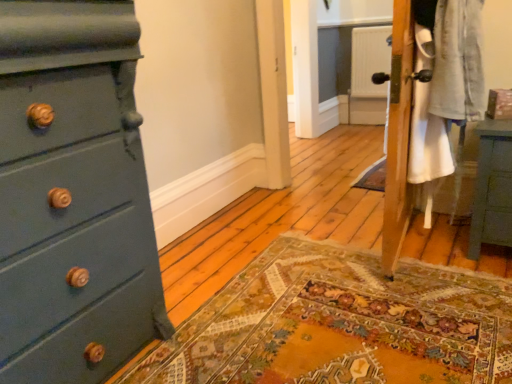
You are a GUI agent. You are given a task and a screenshot of the screen. Output one action in this format:
    pyautogui.click(x=<x>, y=<y>)
    Task: Click on the matte teal dresser at left
    The width and height of the screenshot is (512, 384).
    Given the screenshot: What is the action you would take?
    pyautogui.click(x=73, y=195)

What do you see at coordinates (73, 195) in the screenshot? This screenshot has height=384, width=512. I see `matte teal dresser at left` at bounding box center [73, 195].

This screenshot has height=384, width=512. What do you see at coordinates (492, 188) in the screenshot? I see `teal painted wood nightstand at right` at bounding box center [492, 188].

The height and width of the screenshot is (384, 512). I want to click on teal painted wood nightstand at right, so click(x=492, y=188).

Locate an element on the screen. Image resolution: width=512 pixels, height=384 pixels. matte teal dresser at left is located at coordinates (73, 195).

Considering the positions of objects matte teal dresser at left and teal painted wood nightstand at right in the image provided, who is more to the right, matte teal dresser at left or teal painted wood nightstand at right?

Positioned to the right is teal painted wood nightstand at right.

Is matte teal dresser at left in front of or behind teal painted wood nightstand at right in the image?

Clearly, matte teal dresser at left is in front of teal painted wood nightstand at right.

Consider the image. Which point is more forward, (113,224) or (510,186)?

The point (113,224) is more forward.

From the image's perspective, which object appears higher, matte teal dresser at left or teal painted wood nightstand at right?

From the image's view, teal painted wood nightstand at right is above.

From a real-world perspective, is matte teal dresser at left physically located above or below teal painted wood nightstand at right?

Clearly, from a real-world perspective, matte teal dresser at left is above teal painted wood nightstand at right.

Can you confirm if matte teal dresser at left is wider than teal painted wood nightstand at right?

Correct, the width of matte teal dresser at left exceeds that of teal painted wood nightstand at right.

From their relative heights in the image, would you say matte teal dresser at left is taller or shorter than teal painted wood nightstand at right?

Considering their sizes, matte teal dresser at left has more height than teal painted wood nightstand at right.

Can you confirm if matte teal dresser at left is smaller than teal painted wood nightstand at right?

No.

Which is correct: matte teal dresser at left is inside teal painted wood nightstand at right, or outside of it?

matte teal dresser at left cannot be found inside teal painted wood nightstand at right.

Is matte teal dresser at left beside teal painted wood nightstand at right?

No, matte teal dresser at left is not with teal painted wood nightstand at right.

Is matte teal dresser at left turned away from teal painted wood nightstand at right?

No.

How distant is matte teal dresser at left from teal painted wood nightstand at right?

The distance of matte teal dresser at left from teal painted wood nightstand at right is 4.87 feet.

Locate an element on the screen. nightstand above the matte teal dresser at left (from the image's perspective) is located at coordinates (492, 188).

Is teal painted wood nightstand at right to the left or to the right of matte teal dresser at left in the image?

teal painted wood nightstand at right is to the right of matte teal dresser at left.

Between teal painted wood nightstand at right and matte teal dresser at left, which one is positioned behind?

teal painted wood nightstand at right is further away from the camera.

Considering the positions of points (483, 230) and (15, 337), is point (483, 230) farther from camera compared to point (15, 337)?

That is True.

From the image's perspective, is teal painted wood nightstand at right located above or below matte teal dresser at left?

teal painted wood nightstand at right is situated higher than matte teal dresser at left in the image.

From a real-world perspective, is teal painted wood nightstand at right physically below matte teal dresser at left?

Yes, from a real-world perspective, teal painted wood nightstand at right is beneath matte teal dresser at left.

Considering the sizes of objects teal painted wood nightstand at right and matte teal dresser at left in the image provided, who is thinner, teal painted wood nightstand at right or matte teal dresser at left?

teal painted wood nightstand at right is thinner.

Does teal painted wood nightstand at right have a lesser height compared to matte teal dresser at left?

Correct, teal painted wood nightstand at right is not as tall as matte teal dresser at left.

Can you confirm if teal painted wood nightstand at right is bigger than matte teal dresser at left?

No, teal painted wood nightstand at right is not bigger than matte teal dresser at left.

From the picture: Would you say teal painted wood nightstand at right is inside or outside matte teal dresser at left?

teal painted wood nightstand at right is not enclosed by matte teal dresser at left.

Is teal painted wood nightstand at right beside matte teal dresser at left?

teal painted wood nightstand at right and matte teal dresser at left are clearly separated.

Is teal painted wood nightstand at right facing away from matte teal dresser at left?

No.

Consider the image. How many degrees apart are the facing directions of teal painted wood nightstand at right and matte teal dresser at left?

There is a 90.2-degree angle between the facing directions of teal painted wood nightstand at right and matte teal dresser at left.

Image resolution: width=512 pixels, height=384 pixels. What are the coordinates of `chest of drawers above the teal painted wood nightstand at right (from a real-world perspective)` in the screenshot? It's located at (73, 195).

Find the location of a particular element. chest of drawers above the teal painted wood nightstand at right (from a real-world perspective) is located at coordinates (73, 195).

Find the location of a particular element. The image size is (512, 384). nightstand lying on the right of matte teal dresser at left is located at coordinates (492, 188).